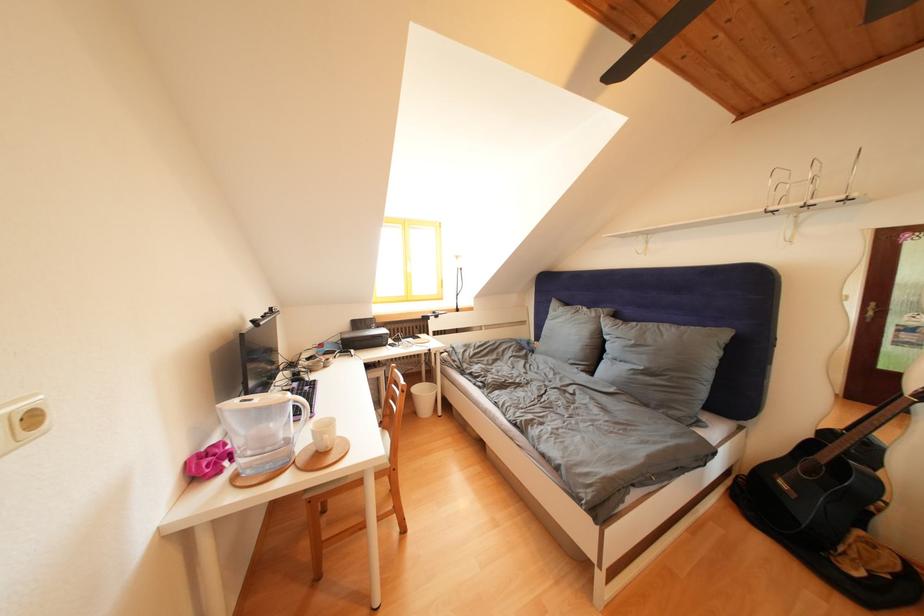
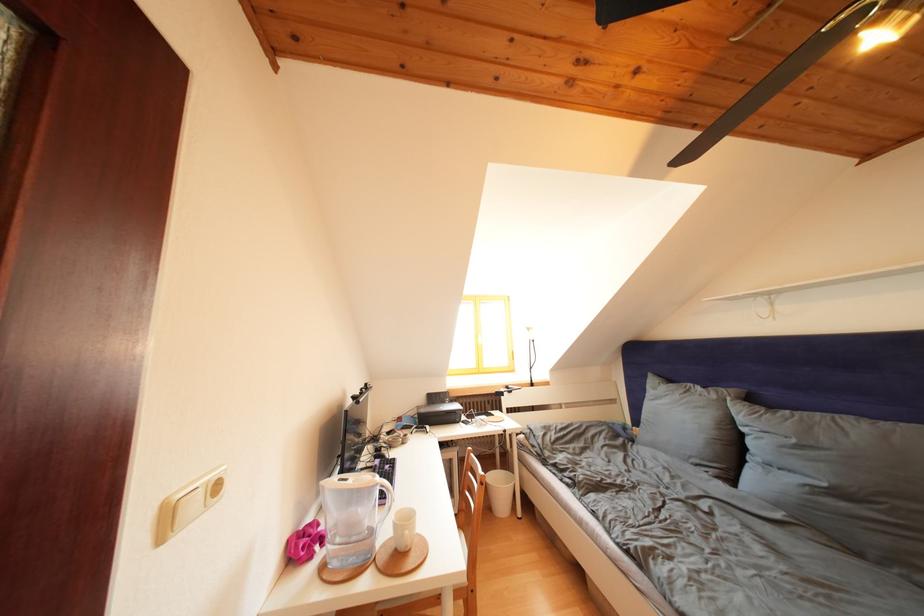
Locate, in the second image, the point that corresponds to point (297, 400) in the first image.

(385, 482)